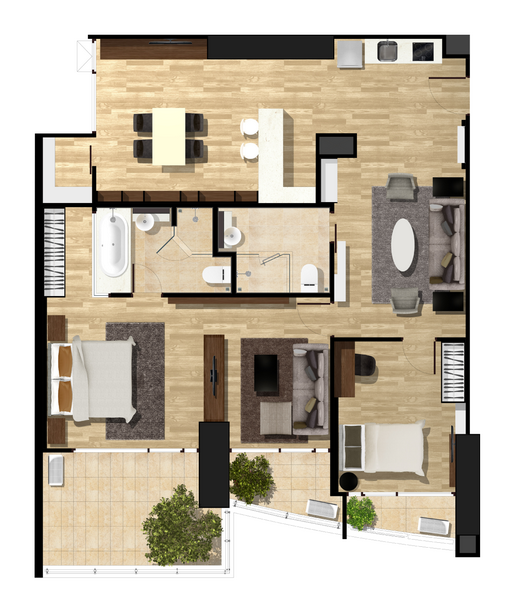
What are the coordinates of `table` in the screenshot? It's located at (168, 142).